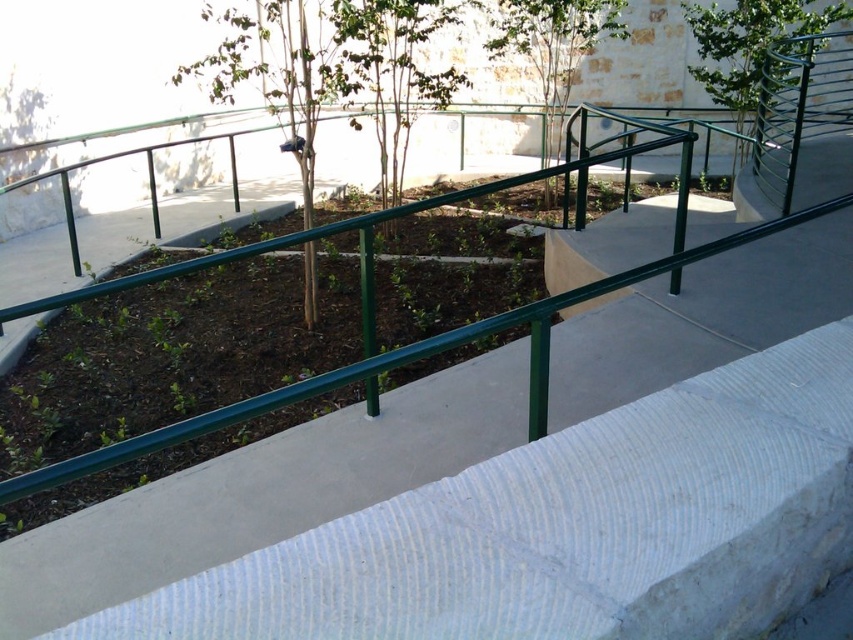
You are a gardener planning to plant a new tree in the outdoor area shown. You have two options for the tree species available. The first is the green matte tree at center, and the second is the green textured tree at center. Considering the space available in the planting bed, which tree would you choose and why?

You should choose the green matte tree at center because it occupies less space than the green textured tree at center, making it a better fit for the planting bed.

You are a gardener who wants to water both the green leafy tree at center and the green textured tree at center. Which tree should you water first if you want to start from the left side?

The green leafy tree at center is positioned on the left side of green textured tree at center, so you should water the green leafy tree at center first.